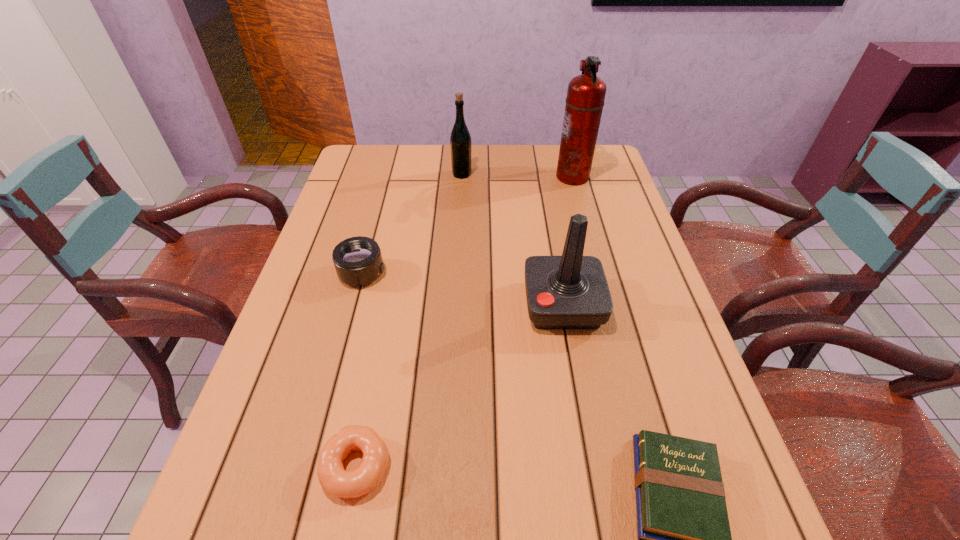
This screenshot has width=960, height=540. I want to click on fire extinguisher, so click(x=586, y=93).

Locate an element on the screen. The image size is (960, 540). the third object from left to right is located at coordinates (460, 140).

Locate an element on the screen. This screenshot has height=540, width=960. joystick is located at coordinates (571, 291).

Locate an element on the screen. telephoto lens is located at coordinates (358, 261).

Where is `doughnut`? The height and width of the screenshot is (540, 960). doughnut is located at coordinates (338, 482).

At what (x,y) coordinates should I click in order to perform the action: click on free spot located 0.060m on the nozzle side of the tallest object. Please return your answer as a coordinate pair (x, y). The height and width of the screenshot is (540, 960). Looking at the image, I should click on (537, 177).

You are a GUI agent. You are given a task and a screenshot of the screen. Output one action in this format:
    pyautogui.click(x=<x>, y=<y>)
    Task: Click on the vacant area situated on the nozzle side of the tallest object
    Image resolution: width=960 pixels, height=540 pixels.
    Given the screenshot: What is the action you would take?
    pyautogui.click(x=468, y=177)

Identify the location of free location located on the nozzle side of the tallest object. The width and height of the screenshot is (960, 540). (512, 177).

This screenshot has height=540, width=960. I want to click on free space located 0.330m on the front of the third object from left to right, so click(458, 248).

At what (x,y) coordinates should I click in order to perform the action: click on vacant space located 0.250m on the back of the joystick. Please return your answer as a coordinate pair (x, y). Looking at the image, I should click on (547, 216).